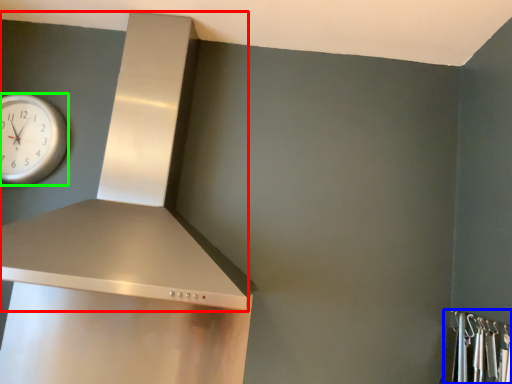
Question: Which object is the closest to the vent (highlighted by a red box)? Choose among these: closet (highlighted by a blue box) or wall clock (highlighted by a green box).

Choices:
 (A) closet
 (B) wall clock

Answer: (B)